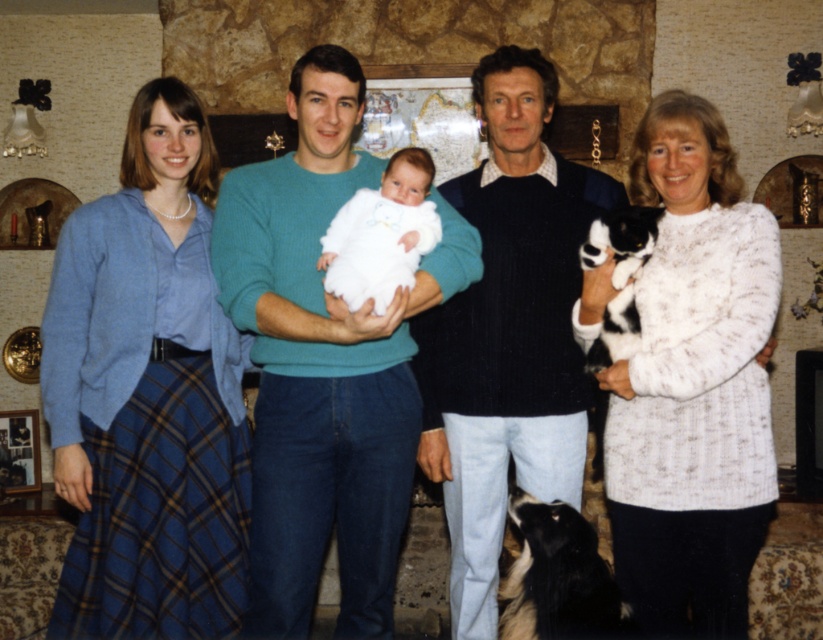
Based on the photo, you are standing in the living room and want to reach the point at coordinates (x=661, y=172). If you take a step forward of 3 feet, how far will you be from that point?

The point at coordinates (x=661, y=172) is 9.41 feet away from the viewer. After stepping forward 3 feet, you would be 9.41 minus 3 equals 6.41 feet away from the point.

You are a photographer trying to capture a closeup of the white knitted sweater at right and the white fluffy baby at center. Which one would appear larger in your photo?

The white knitted sweater at right is closer to the viewer than the white fluffy baby at center, so it would appear larger in the photo.